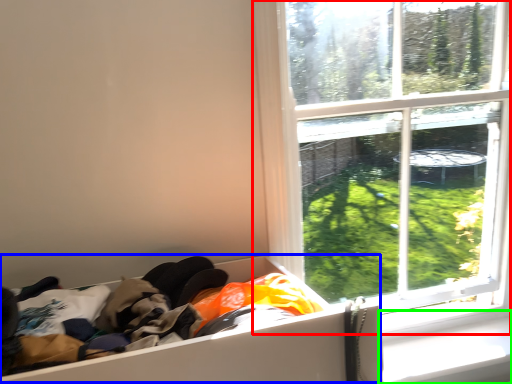
Question: Which object is the farthest from window (highlighted by a red box)? Choose among these: storage box (highlighted by a blue box) or window sill (highlighted by a green box).

Choices:
 (A) storage box
 (B) window sill

Answer: (A)